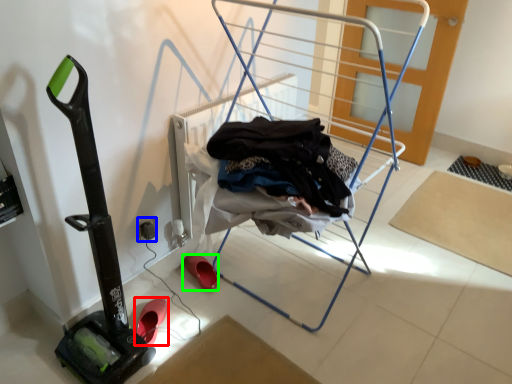
Question: Estimate the real-world distances between objects in this image. Which object is closer to footwear (highlighted by a red box), electric outlet (highlighted by a blue box) or footwear (highlighted by a green box)?

Choices:
 (A) electric outlet
 (B) footwear

Answer: (B)